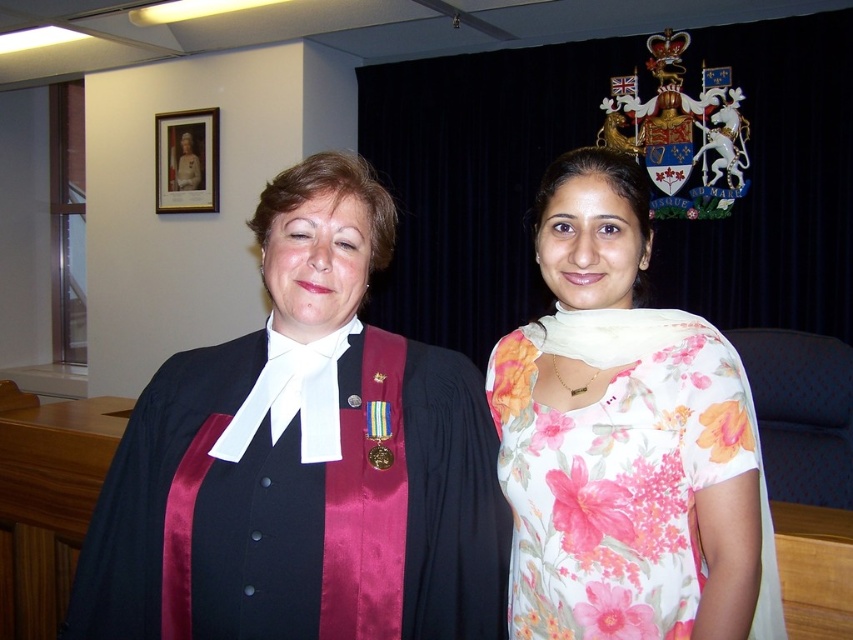
Which is more to the right, floral fabric scarf at center or gold-framed portrait at upper left?

Positioned to the right is floral fabric scarf at center.

Between floral fabric scarf at center and gold-framed portrait at upper left, which one has less height?

floral fabric scarf at center

Find the location of a particular element. The image size is (853, 640). floral fabric scarf at center is located at coordinates (590, 241).

Where is `floral fabric scarf at center`? This screenshot has width=853, height=640. floral fabric scarf at center is located at coordinates (590, 241).

Is point (154, 403) positioned in front of point (589, 284)?

No, (154, 403) is further to viewer.

The width and height of the screenshot is (853, 640). What do you see at coordinates (303, 461) in the screenshot?
I see `satin black robe at center` at bounding box center [303, 461].

Which is in front, point (90, 618) or point (595, 314)?

Point (90, 618) is more forward.

Locate an element on the screen. The width and height of the screenshot is (853, 640). satin black robe at center is located at coordinates (303, 461).

Between satin black robe at center and gold-framed portrait at upper left, which one appears on the right side from the viewer's perspective?

From the viewer's perspective, satin black robe at center appears more on the right side.

Does satin black robe at center appear over gold-framed portrait at upper left?

Actually, satin black robe at center is below gold-framed portrait at upper left.

The height and width of the screenshot is (640, 853). What are the coordinates of `satin black robe at center` in the screenshot? It's located at (303, 461).